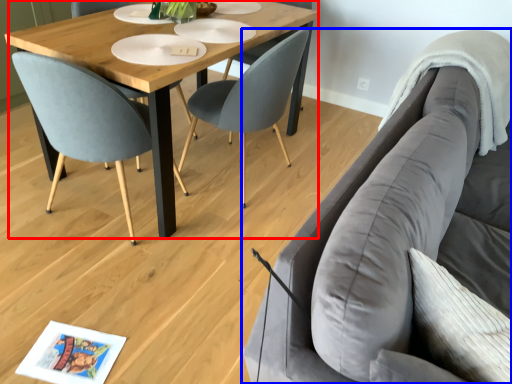
Question: Among these objects, which one is farthest to the camera, coffee table (highlighted by a red box) or studio couch (highlighted by a blue box)?

Choices:
 (A) coffee table
 (B) studio couch

Answer: (A)